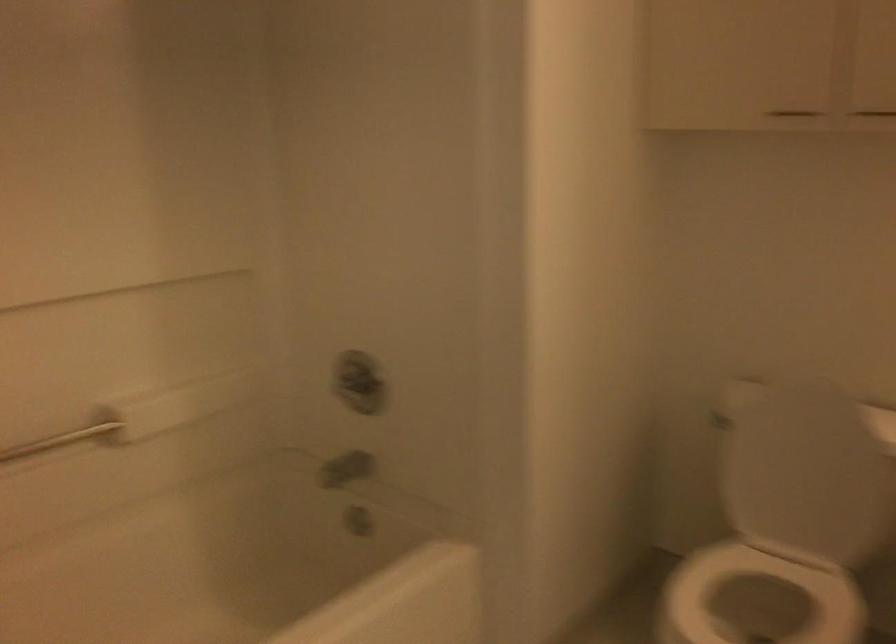
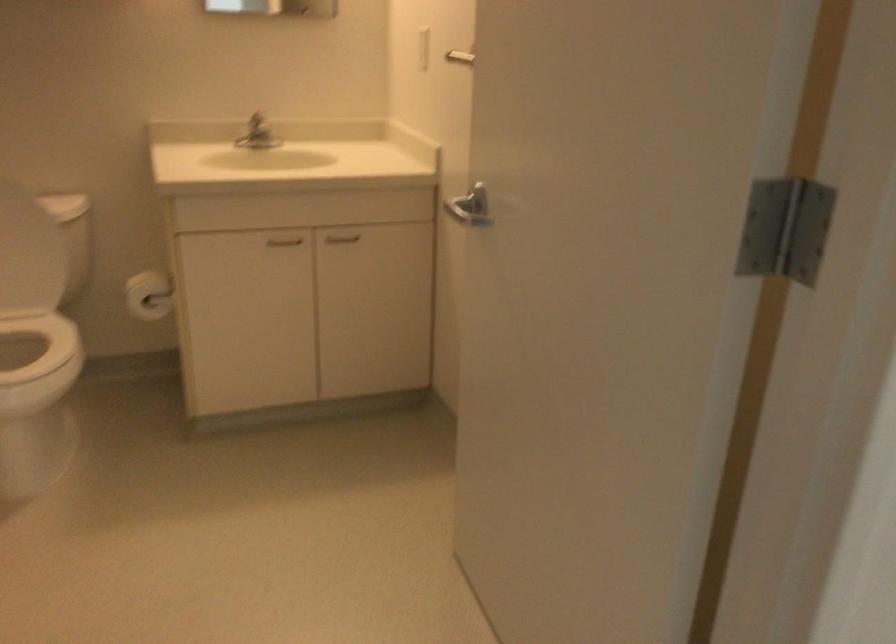
First-person continuous shooting, in which direction is the camera rotating?

The camera rotated toward right-down.